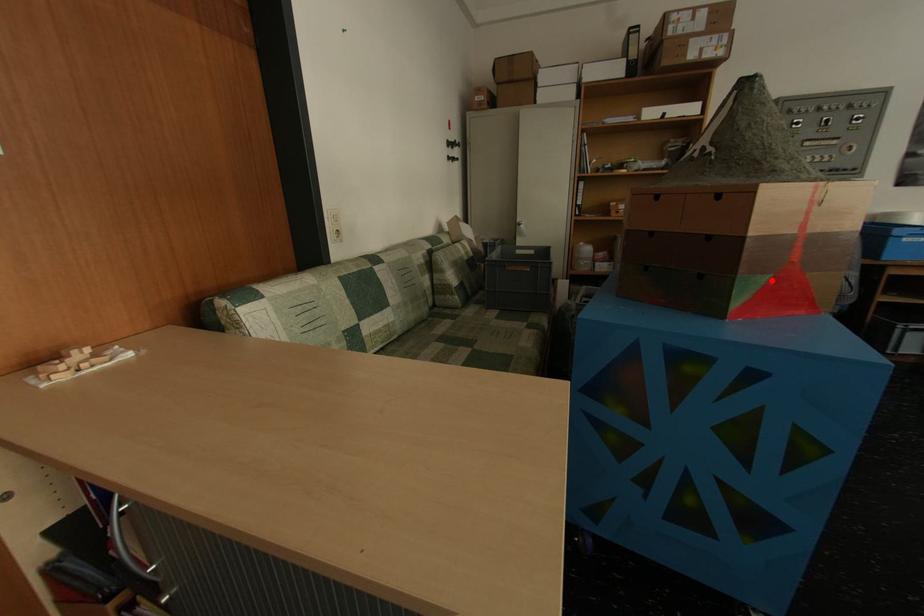
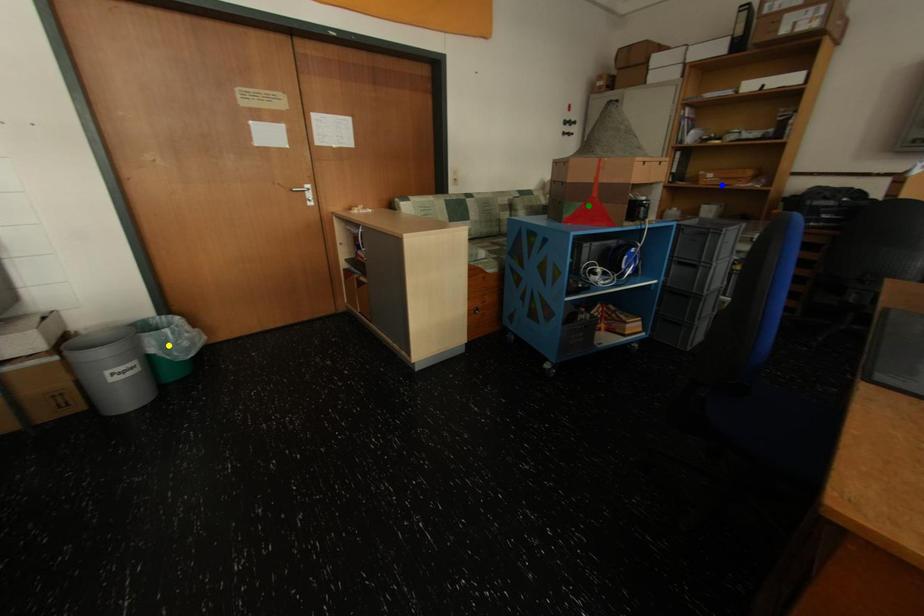
Question: I am providing you with two images of the same scene from different viewpoints. A red point is marked on the first image. You are given multiple points on the second image. Which point in image 2 represents the same 3d spot as the red point in image 1?

Choices:
 (A) yellow point
 (B) blue point
 (C) green point

Answer: (C)